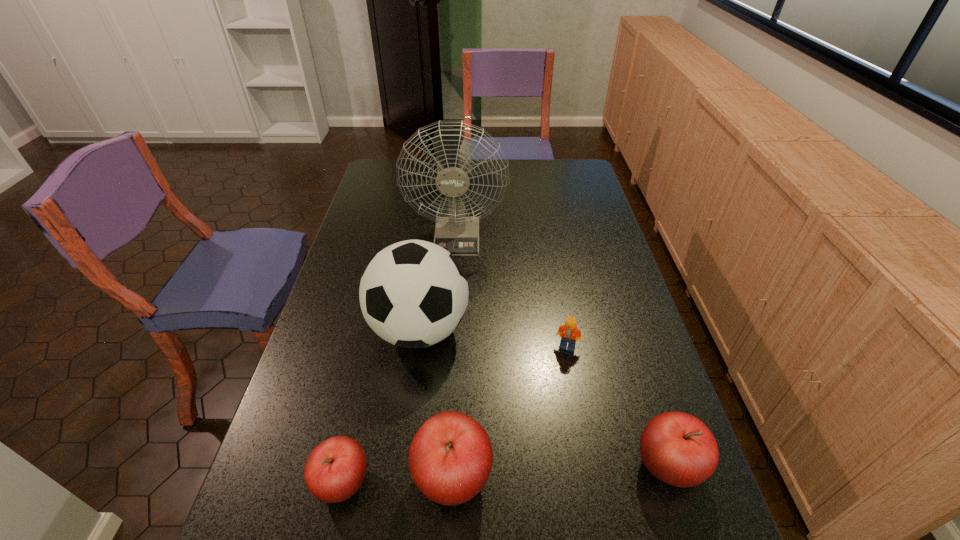
If the aim is uniform spacing by inserting an additional apple among them, please point to a vacant space for this new apple. Please provide its 2D coordinates. Your answer should be formatted as a tuple, i.e. [(x, y)], where the tuple contains the x and y coordinates of a point satisfying the conditions above.

[(562, 471)]